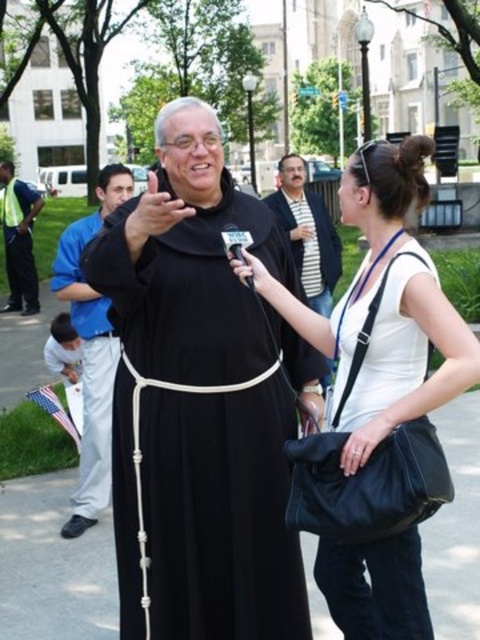
Who is taller, black matte dress at center or reflective yellow vest at left?

reflective yellow vest at left

Is point (186, 339) closer to camera compared to point (24, 250)?

Yes, it is in front of point (24, 250).

At what (x,y) coordinates should I click in order to perform the action: click on black matte dress at center. Please return your answer as a coordinate pair (x, y). Looking at the image, I should click on (207, 422).

Which of these two, black matte robe at center or black matte suit at center, stands taller?

black matte suit at center is taller.

Does black matte robe at center appear on the right side of black matte suit at center?

In fact, black matte robe at center is to the left of black matte suit at center.

Which is behind, point (85, 362) or point (282, 163)?

The point (282, 163) is behind.

Image resolution: width=480 pixels, height=640 pixels. Identify the location of black matte robe at center. (92, 349).

Is white matte bag at center bigger than reflective yellow vest at left?

No, white matte bag at center is not bigger than reflective yellow vest at left.

Which is in front, point (372, 592) or point (41, 196)?

Point (372, 592) is in front.

Is point (418, 602) in front of point (17, 246)?

Yes, point (418, 602) is closer to viewer.

You are a GUI agent. You are given a task and a screenshot of the screen. Output one action in this format:
    pyautogui.click(x=<x>, y=<y>)
    Task: Click on the white matte bag at center
    
    Given the screenshot: What is the action you would take?
    pyautogui.click(x=383, y=305)